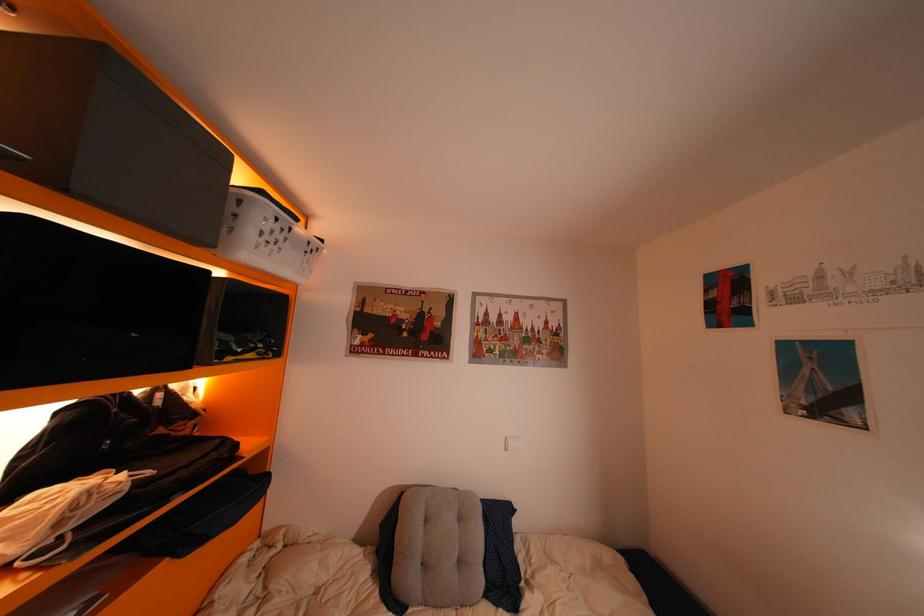
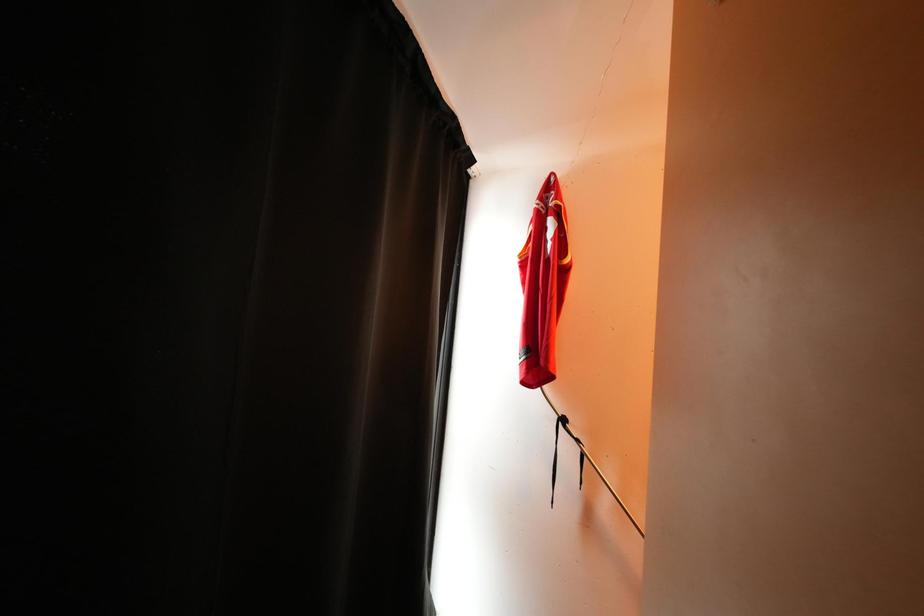
Question: The camera is either moving clockwise (left) or counter-clockwise (right) around the object. The first image is from the beginning of the video and the second image is from the end. Is the camera moving left or right when shooting the video?

Choices:
 (A) Left
 (B) Right

Answer: (B)